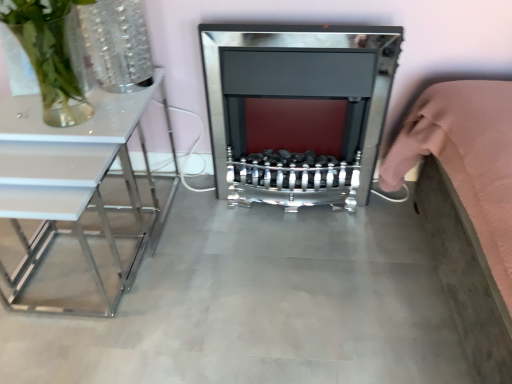
Question: Would you say concretesmoothfloor at center is a long distance from polished chrome fireplace at center?

Choices:
 (A) yes
 (B) no

Answer: (B)

Question: From a real-world perspective, is concretesmoothfloor at center positioned over polished chrome fireplace at center based on gravity?

Choices:
 (A) yes
 (B) no

Answer: (B)

Question: Can you confirm if concretesmoothfloor at center is thinner than polished chrome fireplace at center?

Choices:
 (A) no
 (B) yes

Answer: (A)

Question: Does concretesmoothfloor at center have a smaller size compared to polished chrome fireplace at center?

Choices:
 (A) no
 (B) yes

Answer: (B)

Question: From the image's perspective, would you say concretesmoothfloor at center is positioned over polished chrome fireplace at center?

Choices:
 (A) yes
 (B) no

Answer: (B)

Question: From the image's perspective, relative to white glossy table at left, is polished chrome fireplace at center above or below?

Choices:
 (A) below
 (B) above

Answer: (B)

Question: Visually, is polished chrome fireplace at center positioned to the left or to the right of white glossy table at left?

Choices:
 (A) left
 (B) right

Answer: (B)

Question: Looking at their shapes, would you say polished chrome fireplace at center is wider or thinner than white glossy table at left?

Choices:
 (A) thin
 (B) wide

Answer: (A)

Question: Considering their positions, is polished chrome fireplace at center located in front of or behind white glossy table at left?

Choices:
 (A) behind
 (B) front

Answer: (A)

Question: In the image, is white glossy table at left positioned in front of or behind polished chrome fireplace at center?

Choices:
 (A) behind
 (B) front

Answer: (B)

Question: Choose the correct answer: Is white glossy table at left inside polished chrome fireplace at center or outside it?

Choices:
 (A) outside
 (B) inside

Answer: (A)

Question: Looking at the image, does white glossy table at left seem bigger or smaller compared to polished chrome fireplace at center?

Choices:
 (A) big
 (B) small

Answer: (A)

Question: Considering the relative positions of white glossy table at left and polished chrome fireplace at center in the image provided, is white glossy table at left to the left or to the right of polished chrome fireplace at center?

Choices:
 (A) right
 (B) left

Answer: (B)

Question: Is white glossy table at left in front of or behind pink fabric bed at right in the image?

Choices:
 (A) front
 (B) behind

Answer: (B)

Question: In terms of size, does white glossy table at left appear bigger or smaller than pink fabric bed at right?

Choices:
 (A) big
 (B) small

Answer: (B)